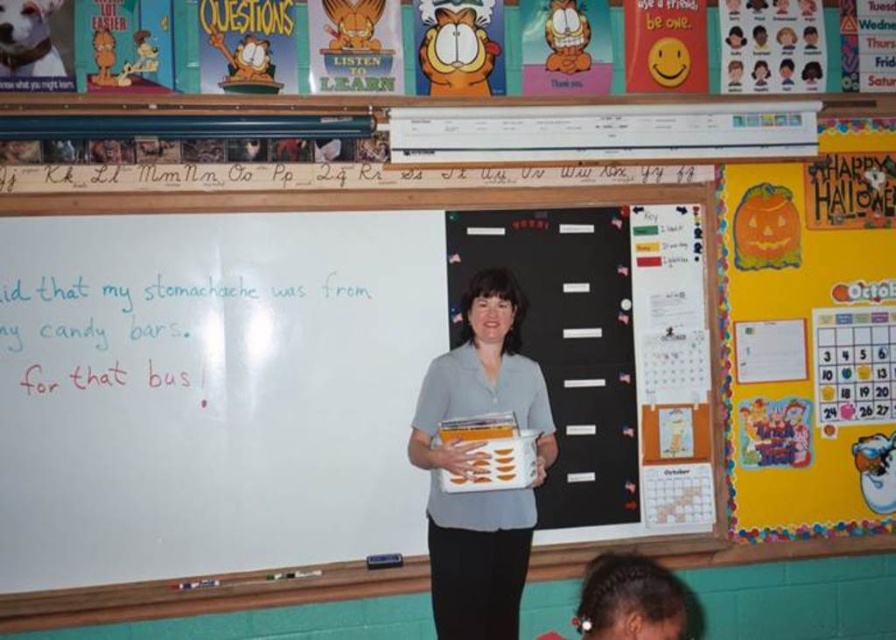
Does yellow paper calendar at upper right appear on the left side of gray fabric shirt at center?

Indeed, yellow paper calendar at upper right is positioned on the left side of gray fabric shirt at center.

Is yellow paper calendar at upper right wider than gray fabric shirt at center?

Indeed, yellow paper calendar at upper right has a greater width compared to gray fabric shirt at center.

What are the coordinates of `yellow paper calendar at upper right` in the screenshot? It's located at (332, 376).